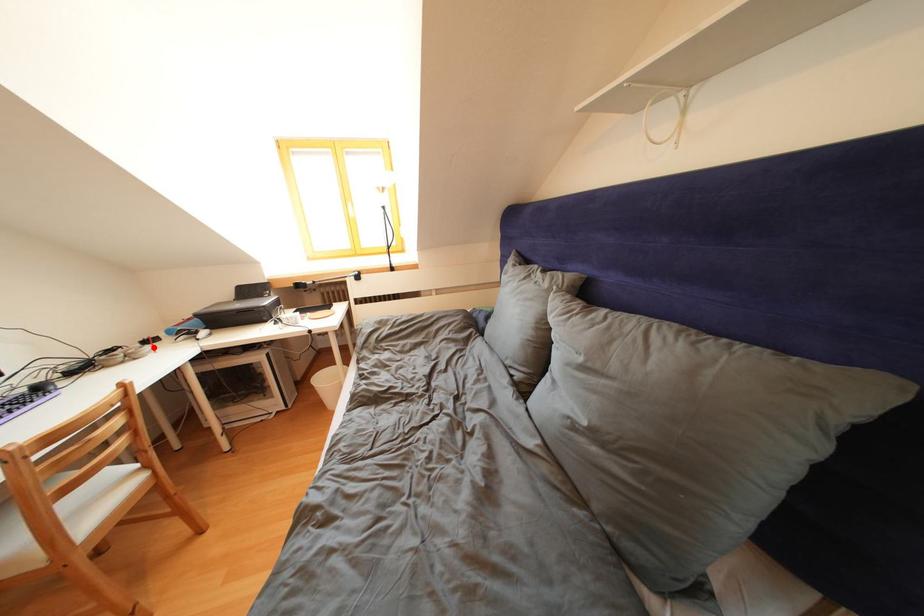
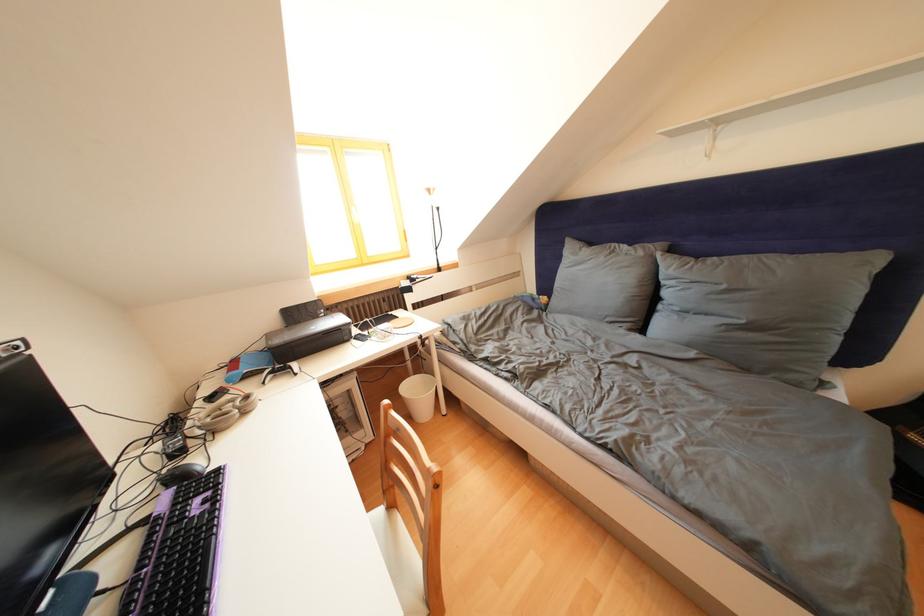
Where in the second image is the point corresponding to the highlighted location from the first image?

(220, 403)